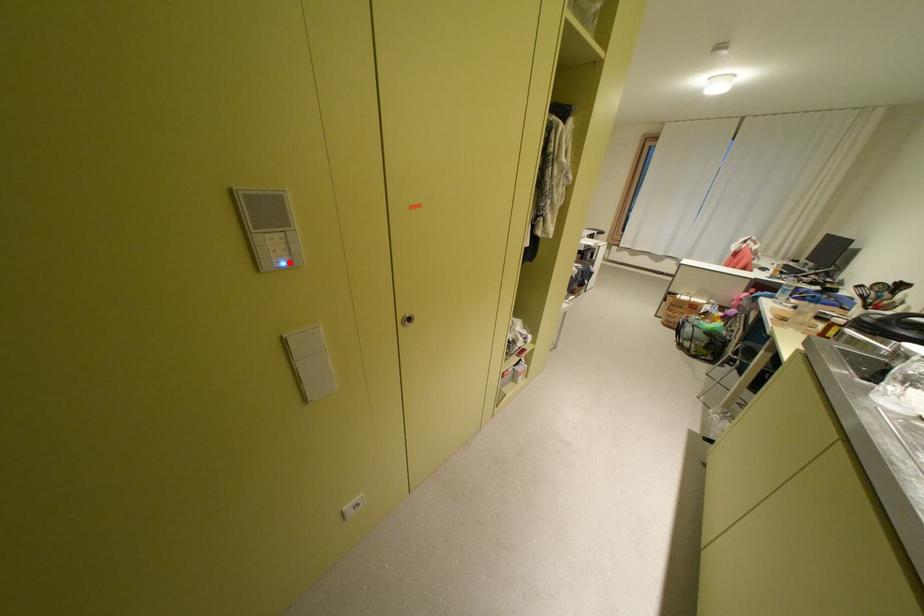
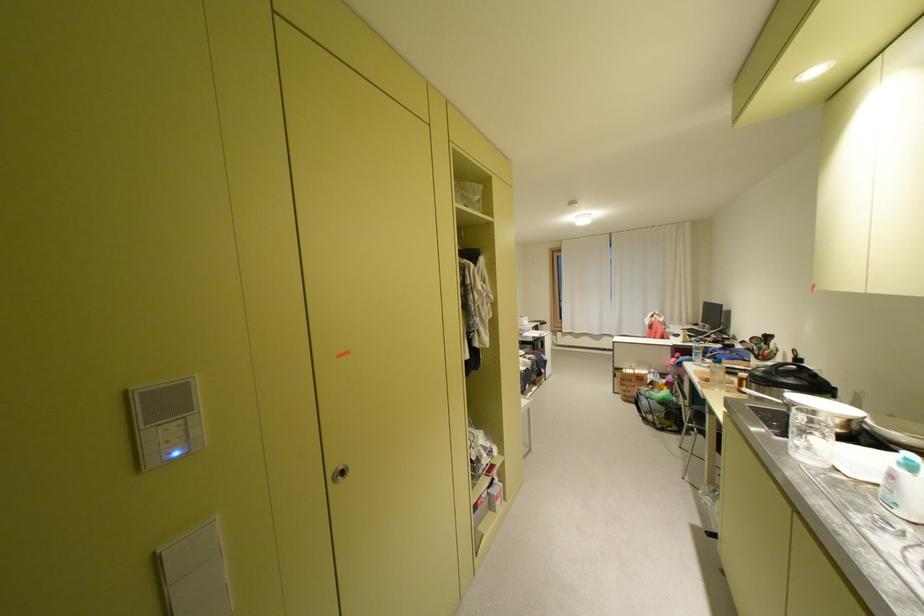
Where in the second image is the point corresponding to the highlighted location from the first image?

(180, 455)